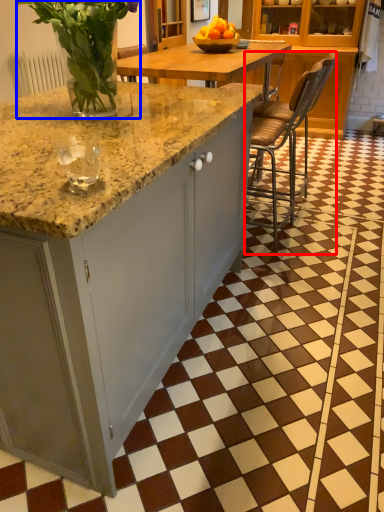
Question: Which point is further to the camera, chair (highlighted by a red box) or floral arrangement (highlighted by a blue box)?

Choices:
 (A) chair
 (B) floral arrangement

Answer: (A)